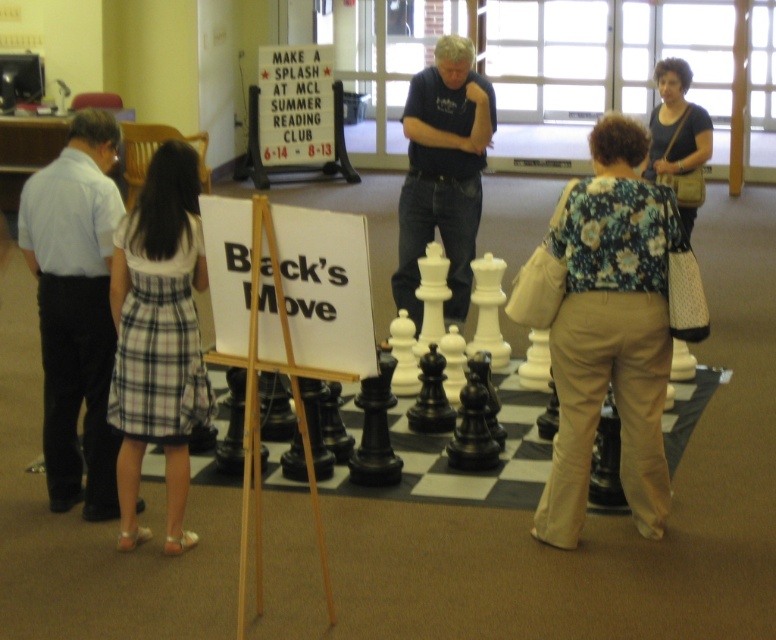
You are standing at the center of the image. Which direction should you move to get closer to the plaid fabric skirt at lower left?

Since the plaid fabric skirt at lower left is located at point [158,337], you should move towards the lower left direction to get closer to it.

You are a photographer taking a picture of the chessboard and the people around it. You need to ensure that the floral fabric blouse at center is visible in the frame. Based on its position, where should you aim your camera to include it?

The floral fabric blouse at center is located at point (x=611, y=332), which is near the center of the image. To include it in the frame, aim the camera so that the center of the viewfinder aligns with this position.

You are a photographer trying to capture a clear shot of the dark blue shirt at center and the matte brown purse at upper right. Since you want both subjects to be in focus, which object should you focus on first considering their heights?

The dark blue shirt at center has a greater height compared to the matte brown purse at upper right, so you should focus on the dark blue shirt at center first to ensure both are in focus.